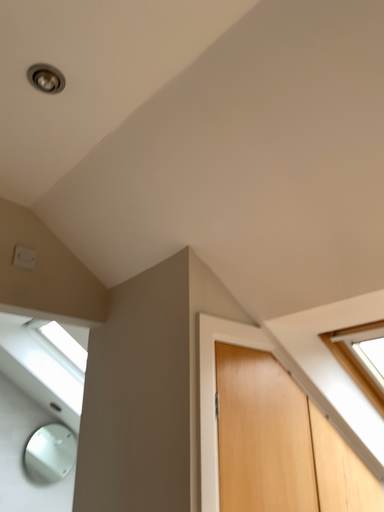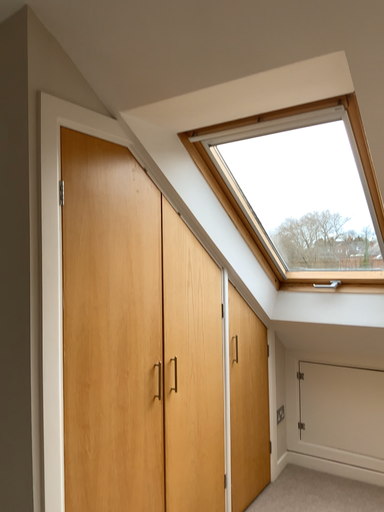
Question: How did the camera likely rotate when shooting the video?

Choices:
 (A) rotated left
 (B) rotated right

Answer: (B)